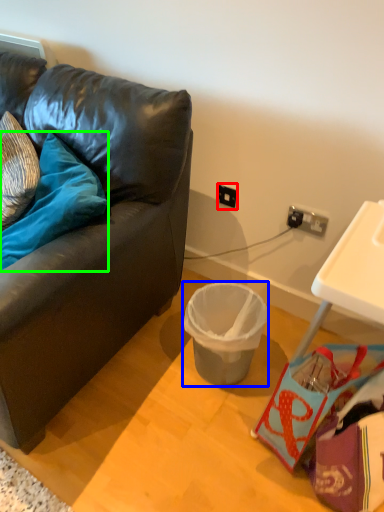
Question: Based on their relative distances, which object is nearer to power outlet (highlighted by a red box)? Choose from trash bin/can (highlighted by a blue box) and pillow (highlighted by a green box).

Choices:
 (A) trash bin/can
 (B) pillow

Answer: (A)